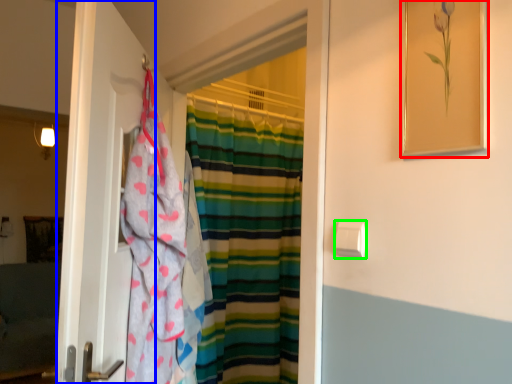
Question: Based on their relative distances, which object is farther from picture frame (highlighted by a red box)? Choose from door (highlighted by a blue box) and towel bar (highlighted by a green box).

Choices:
 (A) door
 (B) towel bar

Answer: (A)